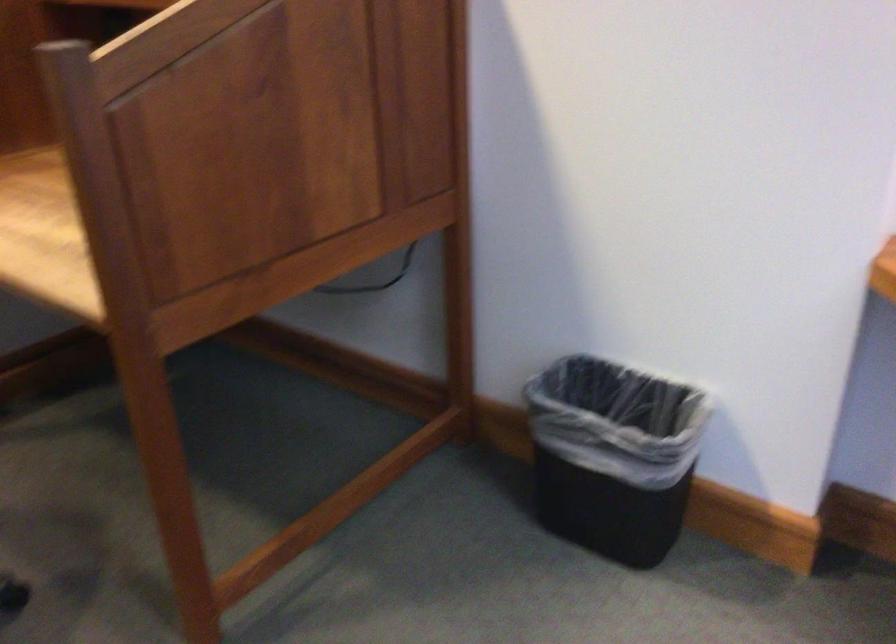
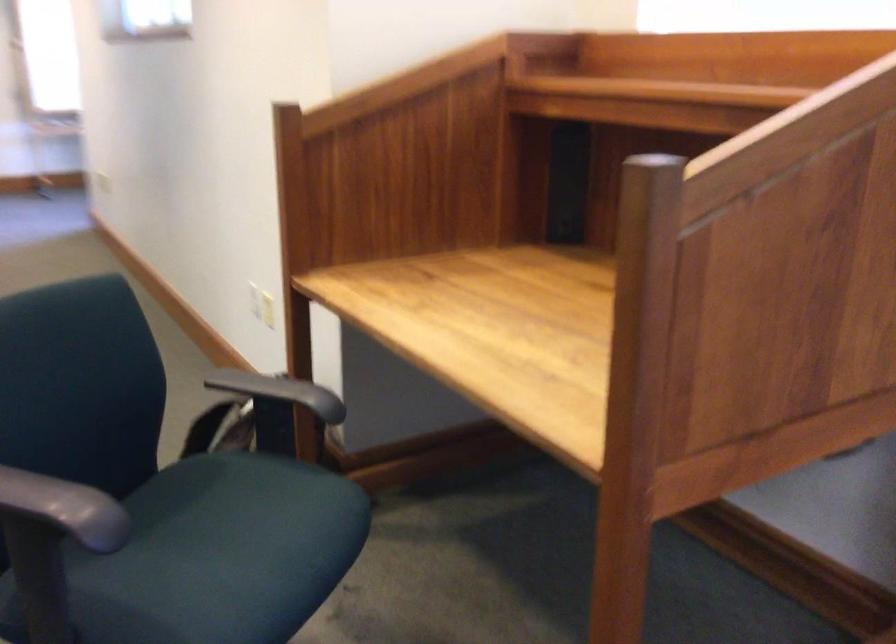
In a continuous first-person perspective shot, in which direction is the camera moving?

The movement direction of the cameraman is left, forward.